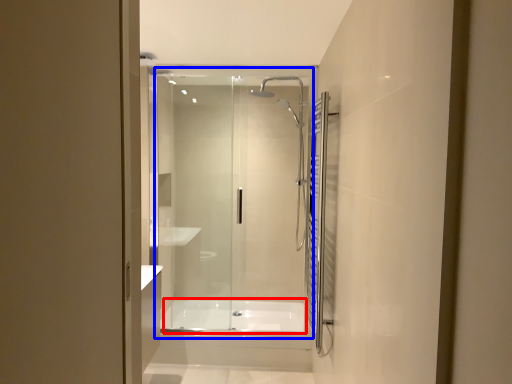
Question: Which object appears closest to the camera in this image, bath (highlighted by a red box) or glass door (highlighted by a blue box)?

Choices:
 (A) bath
 (B) glass door

Answer: (B)